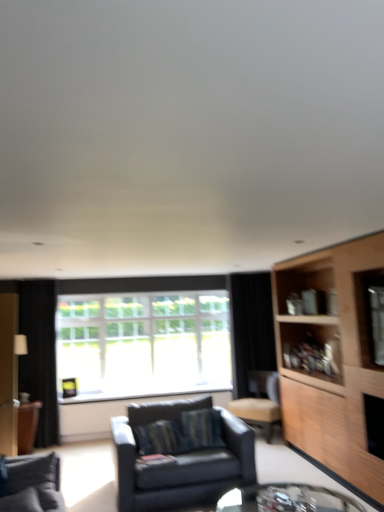
Question: Considering the positions of clear glass window at center and leather-like beige chair at center-right in the image, is clear glass window at center wider or thinner than leather-like beige chair at center-right?

Choices:
 (A) wide
 (B) thin

Answer: (B)

Question: Is point (64, 302) positioned closer to the camera than point (253, 397)?

Choices:
 (A) closer
 (B) farther

Answer: (A)

Question: Estimate the real-world distances between objects in this image. Which object is farther from the leather-like beige chair at center-right?

Choices:
 (A) dark gray fabric couch at lower left, the second studio couch viewed from the back
 (B) clear glass window at center
 (C) clear glass table at lower center
 (D) black fabric curtain at right, the 1th curtain from the right
 (E) light wood cabinet at right

Answer: (A)

Question: Based on their relative distances, which object is nearer to the matte black couch at center, the first studio couch when ordered from back to front?

Choices:
 (A) clear glass table at lower center
 (B) black fabric curtain at right, the second curtain when ordered from front to back
 (C) leather-like beige chair at center-right
 (D) clear glass window at center
 (E) dark gray fabric couch at lower left, the second studio couch viewed from the back

Answer: (A)